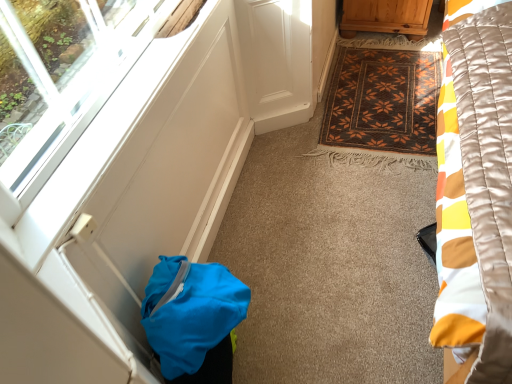
Question: Is the depth of brown woven mat at center less than that of wooden cabinet at upper right?

Choices:
 (A) yes
 (B) no

Answer: (A)

Question: Is brown woven mat at center thinner than wooden cabinet at upper right?

Choices:
 (A) no
 (B) yes

Answer: (A)

Question: Would you consider brown woven mat at center to be distant from wooden cabinet at upper right?

Choices:
 (A) no
 (B) yes

Answer: (A)

Question: Is wooden cabinet at upper right at the back of brown woven mat at center?

Choices:
 (A) no
 (B) yes

Answer: (A)

Question: From the image's perspective, is brown woven mat at center on wooden cabinet at upper right?

Choices:
 (A) no
 (B) yes

Answer: (A)

Question: In terms of height, does transparent glass window at lower left look taller or shorter compared to wooden cabinet at upper right?

Choices:
 (A) short
 (B) tall

Answer: (A)

Question: From a real-world perspective, relative to wooden cabinet at upper right, is transparent glass window at lower left vertically above or below?

Choices:
 (A) below
 (B) above

Answer: (B)

Question: In terms of size, does transparent glass window at lower left appear bigger or smaller than wooden cabinet at upper right?

Choices:
 (A) big
 (B) small

Answer: (B)

Question: Is transparent glass window at lower left in front of or behind wooden cabinet at upper right in the image?

Choices:
 (A) front
 (B) behind

Answer: (A)

Question: Is blue fabric bag at lower left to the left or to the right of brown woven mat at center in the image?

Choices:
 (A) right
 (B) left

Answer: (B)

Question: Considering their positions, is blue fabric bag at lower left located in front of or behind brown woven mat at center?

Choices:
 (A) behind
 (B) front

Answer: (B)

Question: From the image's perspective, is blue fabric bag at lower left positioned above or below brown woven mat at center?

Choices:
 (A) below
 (B) above

Answer: (A)

Question: From a real-world perspective, is blue fabric bag at lower left physically located above or below brown woven mat at center?

Choices:
 (A) below
 (B) above

Answer: (B)

Question: Looking at their shapes, would you say transparent glass window at lower left is wider or thinner than blue fabric bag at lower left?

Choices:
 (A) thin
 (B) wide

Answer: (A)

Question: Is transparent glass window at lower left in front of or behind blue fabric bag at lower left in the image?

Choices:
 (A) behind
 (B) front

Answer: (B)